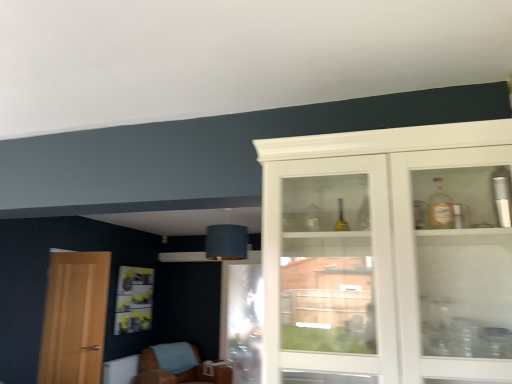
Question: Is light brown wooden door at left beside brown leather chair at lower left?

Choices:
 (A) yes
 (B) no

Answer: (B)

Question: Is light brown wooden door at left further to the viewer compared to brown leather chair at lower left?

Choices:
 (A) no
 (B) yes

Answer: (A)

Question: Considering the relative positions of light brown wooden door at left and brown leather chair at lower left in the image provided, is light brown wooden door at left to the right of brown leather chair at lower left from the viewer's perspective?

Choices:
 (A) yes
 (B) no

Answer: (B)

Question: From the image's perspective, does light brown wooden door at left appear lower than brown leather chair at lower left?

Choices:
 (A) no
 (B) yes

Answer: (A)

Question: Is light brown wooden door at left wider than brown leather chair at lower left?

Choices:
 (A) yes
 (B) no

Answer: (B)

Question: Can you confirm if light brown wooden door at left is smaller than brown leather chair at lower left?

Choices:
 (A) no
 (B) yes

Answer: (B)

Question: Is white glass cabinet at right to the right of brown leather chair at lower left from the viewer's perspective?

Choices:
 (A) no
 (B) yes

Answer: (B)

Question: Is white glass cabinet at right not near brown leather chair at lower left?

Choices:
 (A) yes
 (B) no

Answer: (A)

Question: Does white glass cabinet at right touch brown leather chair at lower left?

Choices:
 (A) no
 (B) yes

Answer: (A)

Question: From the image's perspective, would you say white glass cabinet at right is shown under brown leather chair at lower left?

Choices:
 (A) yes
 (B) no

Answer: (B)

Question: Is white glass cabinet at right completely or partially outside of brown leather chair at lower left?

Choices:
 (A) no
 (B) yes

Answer: (B)

Question: From the image's perspective, is white glass cabinet at right above brown leather chair at lower left?

Choices:
 (A) yes
 (B) no

Answer: (A)

Question: Can you confirm if brown leather chair at lower left is bigger than transparent glass screen door at lower center?

Choices:
 (A) no
 (B) yes

Answer: (B)